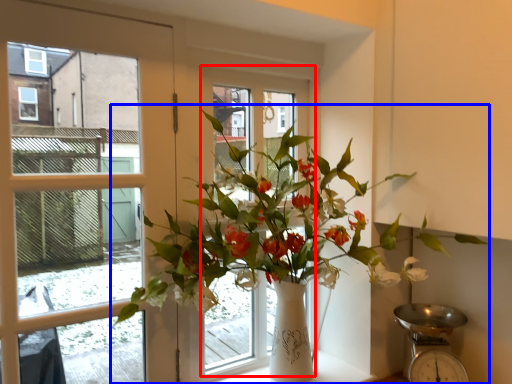
Question: Which object is further to the camera taking this photo, window frame (highlighted by a red box) or houseplant (highlighted by a blue box)?

Choices:
 (A) window frame
 (B) houseplant

Answer: (A)